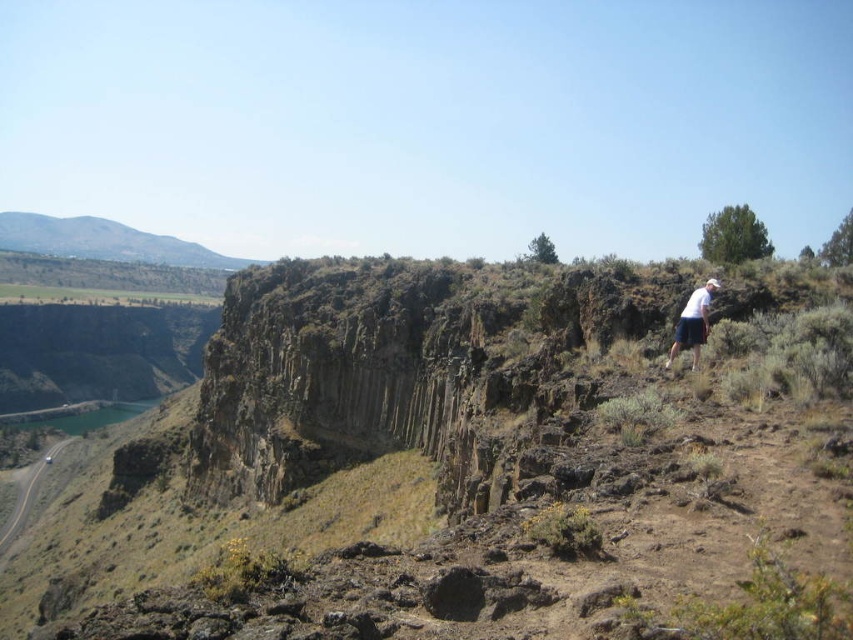
You are a hiker standing at the base of the cliff and want to take a photo of both the green grassy hill at upper left and the white cotton shirt at upper right. Which object should you pan your camera to the left to include in your photo first?

The green grassy hill at upper left should be panned to the left first since it is positioned on the left side of the white cotton shirt at upper right.

You are a hiker planning to travel from the green grassy hill at upper left to the white cotton shirt at upper right. Given that the distance between them is 621.69 meters, and you can only move along the visible paths, which path would you choose and why?

The green grassy hill at upper left is 621.69 meters from the white cotton shirt at upper right. Since the distance is already provided, the most direct path along the visible routes would be the most efficient choice to minimize travel time and effort.

You are a hiker planning to cross the valley. You see the smooth asphalt road at lower left and the white cotton shirt at upper right. Which path would allow you to travel further without encountering obstacles?

The smooth asphalt road at lower left has a larger size compared to the white cotton shirt at upper right, so it is more likely to be a proper path for travel. Therefore, choosing the smooth asphalt road at lower left would allow you to travel further without obstacles.